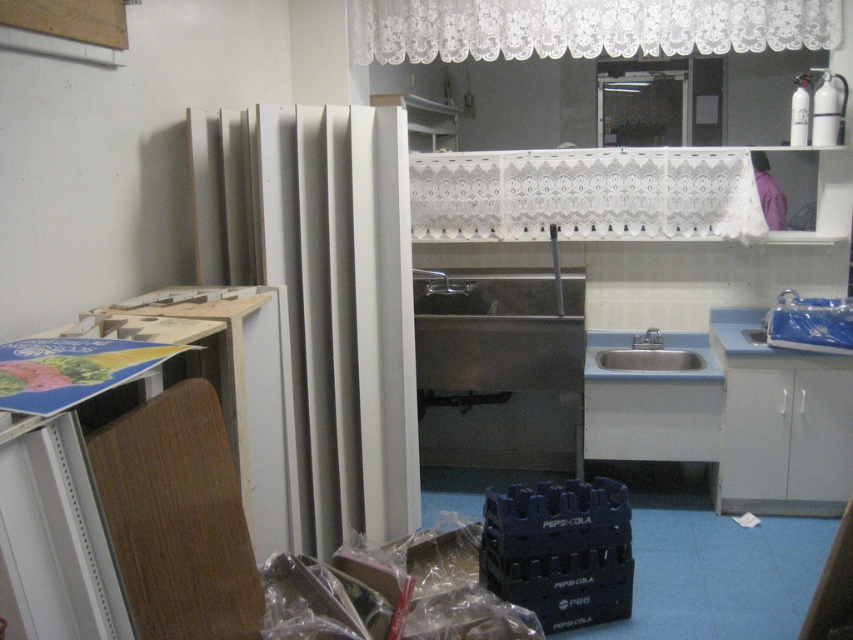
Is white lace curtain at upper center shorter than satin silver sink at center?

Incorrect, white lace curtain at upper center's height does not fall short of satin silver sink at center's.

Can you confirm if white lace curtain at upper center is positioned above satin silver sink at center?

Yes, white lace curtain at upper center is above satin silver sink at center.

What do you see at coordinates (584, 28) in the screenshot?
I see `white lace curtain at upper center` at bounding box center [584, 28].

Where is `white lace curtain at upper center`? The image size is (853, 640). white lace curtain at upper center is located at coordinates (584, 28).